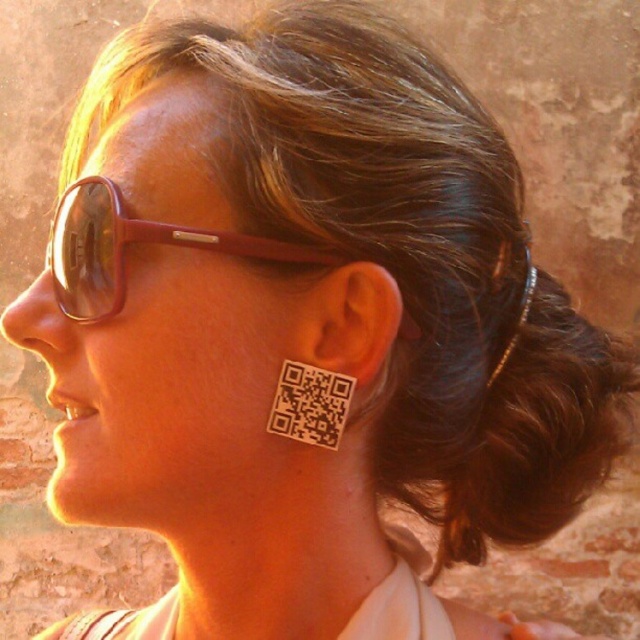
Question: Does matte brown goggles at upper left have a greater width compared to white matte qr code at ear?

Choices:
 (A) no
 (B) yes

Answer: (B)

Question: Which of the following is the farthest from the observer?

Choices:
 (A) (49, 252)
 (B) (401, 310)

Answer: (A)

Question: Which object appears farthest from the camera in this image?

Choices:
 (A) matte brown goggles at upper left
 (B) white matte qr code at ear

Answer: (B)

Question: Observing the image, what is the correct spatial positioning of matte brown goggles at upper left in reference to white matte qr code at ear?

Choices:
 (A) above
 (B) below

Answer: (A)

Question: In this image, where is matte brown goggles at upper left located relative to white matte qr code at ear?

Choices:
 (A) left
 (B) right

Answer: (A)